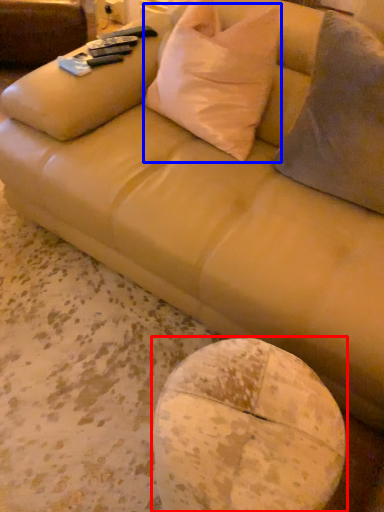
Question: Which object is further to the camera taking this photo, round table (highlighted by a red box) or throw pillow (highlighted by a blue box)?

Choices:
 (A) round table
 (B) throw pillow

Answer: (B)